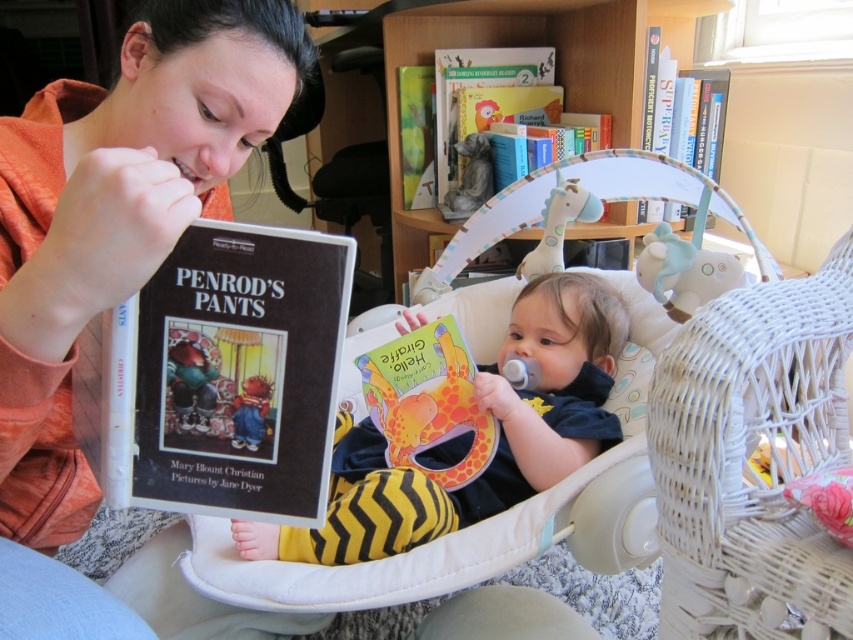
Does white wicker baby carriage at center have a lesser height compared to wooden bookshelf at upper center?

Yes.

Which is above, white wicker baby carriage at center or wooden bookshelf at upper center?

wooden bookshelf at upper center is higher up.

Between point (181, 568) and point (434, 216), which one is positioned behind?

Positioned behind is point (434, 216).

Locate an element on the screen. The height and width of the screenshot is (640, 853). white wicker baby carriage at center is located at coordinates (387, 557).

Is matte orange sweatshirt at upper left shorter than yellow zigzag pants at center?

Incorrect, matte orange sweatshirt at upper left's height does not fall short of yellow zigzag pants at center's.

Is matte orange sweatshirt at upper left taller than yellow zigzag pants at center?

Correct, matte orange sweatshirt at upper left is much taller as yellow zigzag pants at center.

At what (x,y) coordinates should I click in order to perform the action: click on matte orange sweatshirt at upper left. Please return your answer as a coordinate pair (x, y). Looking at the image, I should click on (109, 253).

Find the location of a particular element. The image size is (853, 640). matte orange sweatshirt at upper left is located at coordinates (109, 253).

How far apart are wooden bookshelf at upper center and hardcover book at upper right?

wooden bookshelf at upper center and hardcover book at upper right are 9.07 inches apart.

Is wooden bookshelf at upper center closer to the viewer compared to hardcover book at upper right?

That is True.

Who is more distant from viewer, (393, 22) or (717, 83)?

The point (393, 22) is behind.

In order to click on wooden bookshelf at upper center in this screenshot , I will do `click(553, 76)`.